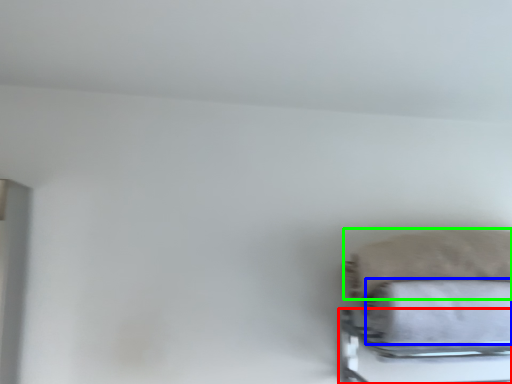
Question: Considering the real-world distances, which object is closest to bed frame (highlighted by a red box)? bath towel (highlighted by a blue box) or pillow (highlighted by a green box).

Choices:
 (A) bath towel
 (B) pillow

Answer: (A)